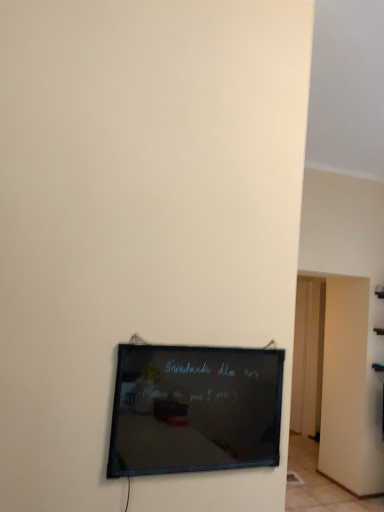
Question: Looking at their shapes, would you say black glass board at lower center is wider or thinner than wooden door at right?

Choices:
 (A) wide
 (B) thin

Answer: (A)

Question: In terms of size, does black glass board at lower center appear bigger or smaller than wooden door at right?

Choices:
 (A) big
 (B) small

Answer: (B)

Question: Is black glass board at lower center situated inside wooden door at right or outside?

Choices:
 (A) inside
 (B) outside

Answer: (B)

Question: Considering the relative positions of wooden door at right and black glass board at lower center in the image provided, is wooden door at right to the left or to the right of black glass board at lower center?

Choices:
 (A) right
 (B) left

Answer: (A)

Question: Is wooden door at right taller or shorter than black glass board at lower center?

Choices:
 (A) tall
 (B) short

Answer: (A)

Question: Is wooden door at right spatially inside black glass board at lower center, or outside of it?

Choices:
 (A) inside
 (B) outside

Answer: (B)

Question: From a real-world perspective, is wooden door at right physically located above or below black glass board at lower center?

Choices:
 (A) below
 (B) above

Answer: (A)